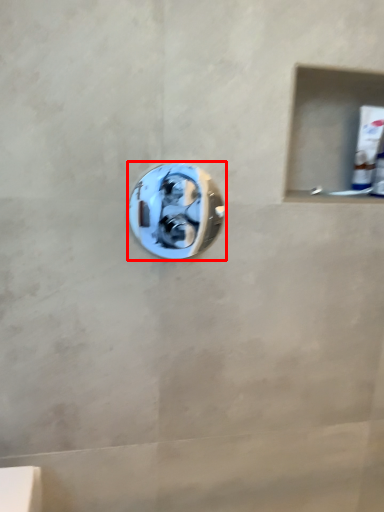
Question: From the image's perspective, where is door handle (annotated by the red box) located in relation to toothpaste in the image?

Choices:
 (A) above
 (B) below

Answer: (B)